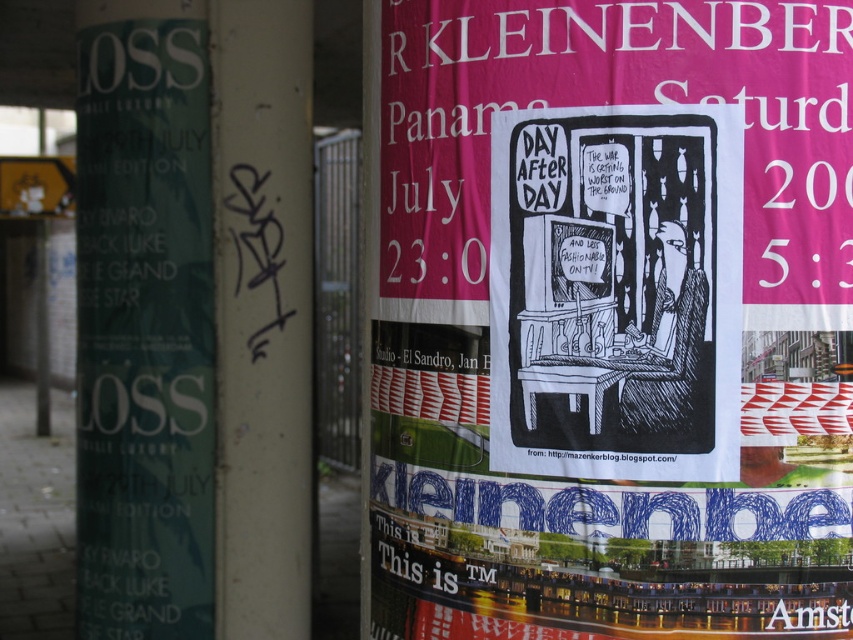
You are a photographer trying to capture the black paper poster at center without the white painted pillar at center blocking the view. Is this possible given their positions?

The black paper poster at center is in front of the white painted pillar at center, so you can capture the black paper poster at center without the white painted pillar at center blocking the view since it is already positioned in front.

You are standing in front of the poster on the street. There are two points marked on the poster. The first point is at coordinate (747, 131) and the second is at (265, 563). Which point is closer to you?

The point at coordinate (747, 131) is closer to you than the point at (265, 563).